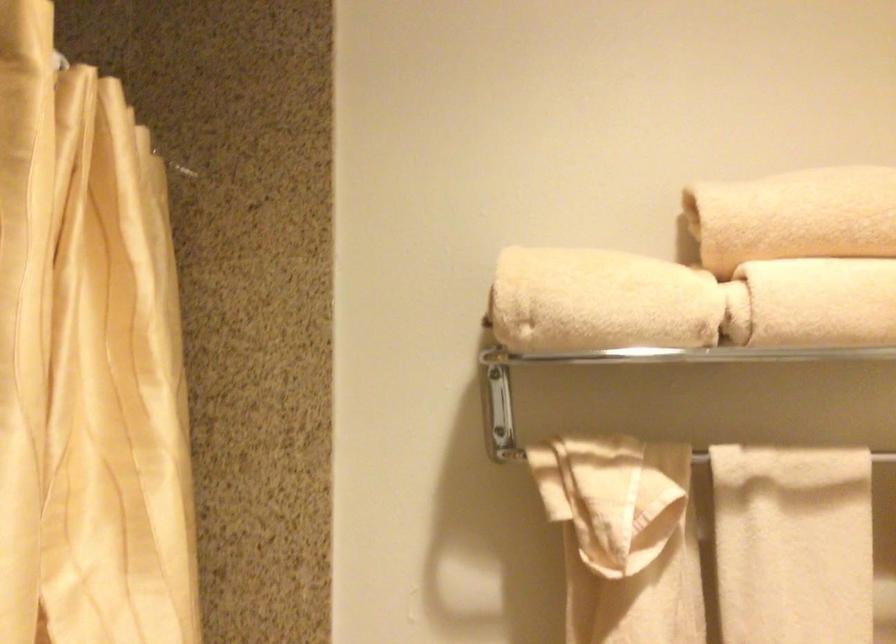
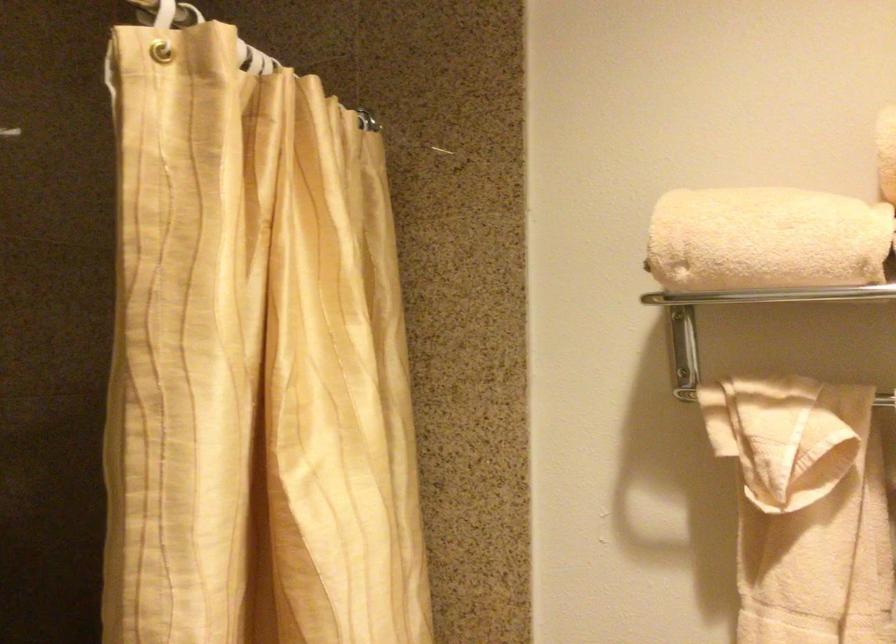
In the second image, find the point that corresponds to point 142,144 in the first image.

(366, 120)